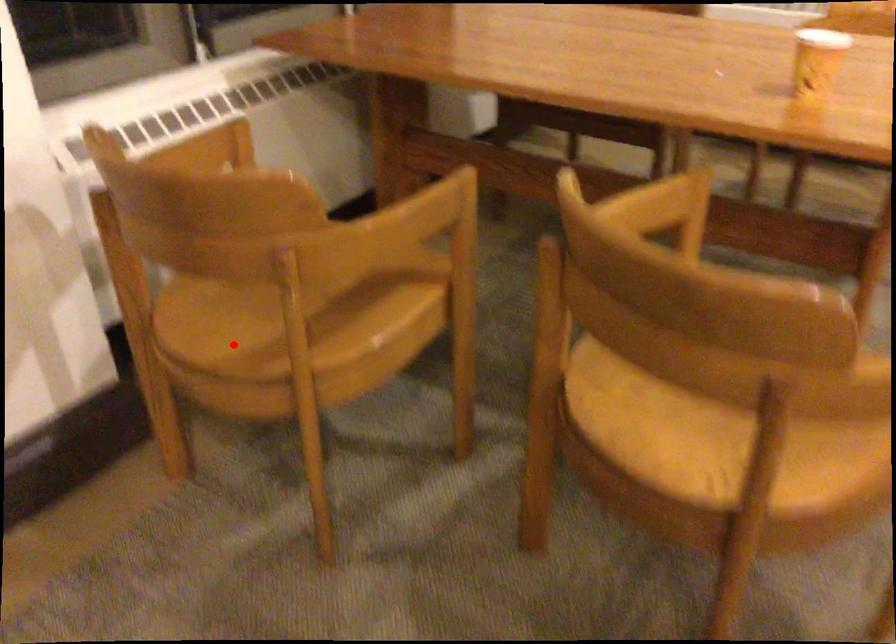
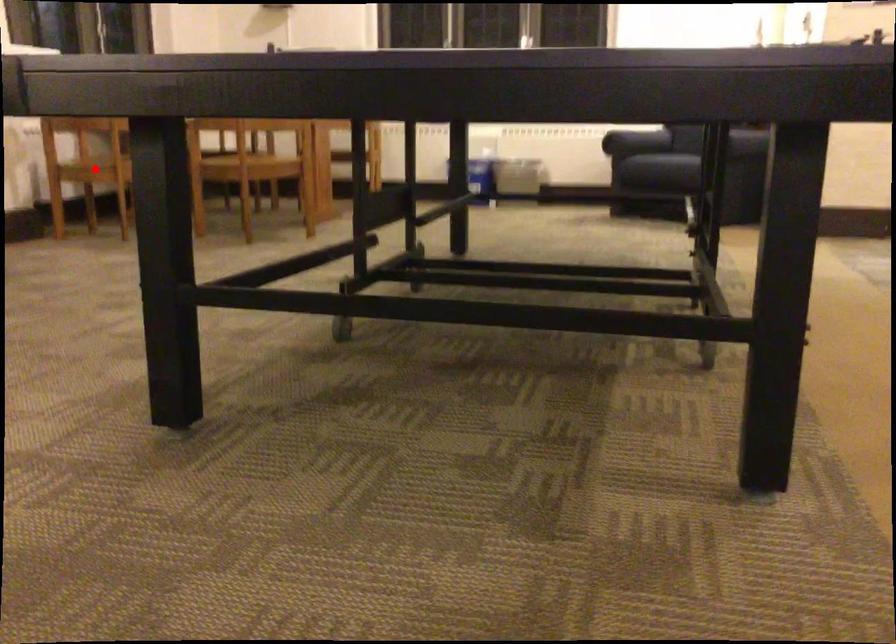
I am providing you with two images of the same scene from different viewpoints. A red point is marked on the first image and another point is marked on the second image. Are the points marked in image1 and image2 representing the same 3D position?

Yes